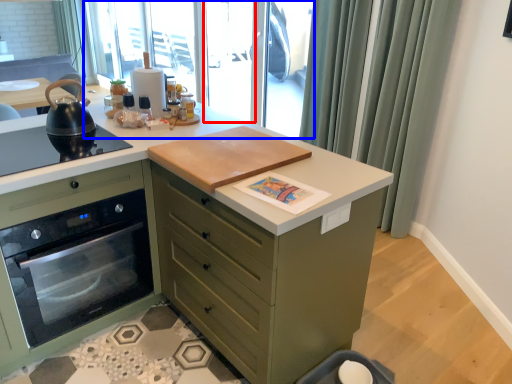
Question: Which object is closer to the camera taking this photo, screen door (highlighted by a red box) or window screen (highlighted by a blue box)?

Choices:
 (A) screen door
 (B) window screen

Answer: (B)